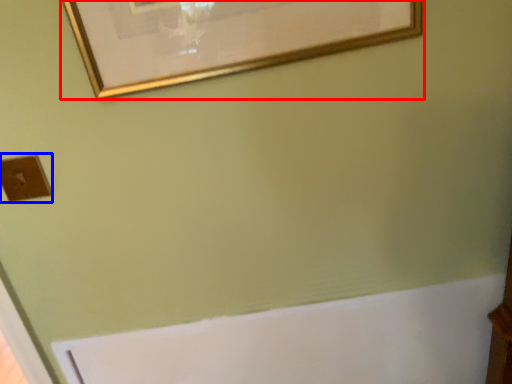
Question: Which object is closer to the camera taking this photo, picture frame (highlighted by a red box) or light switch (highlighted by a blue box)?

Choices:
 (A) picture frame
 (B) light switch

Answer: (A)